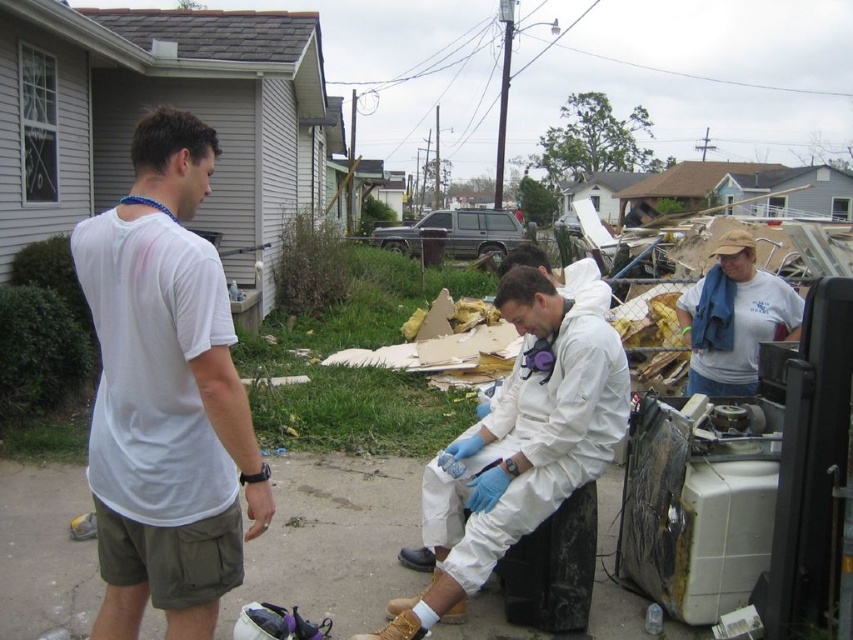
Between white cotton t-shirt at left and white matte hazmat suit at center, which one appears on the left side from the viewer's perspective?

white cotton t-shirt at left is more to the left.

Which is behind, point (219, 433) or point (425, 621)?

The point (425, 621) is behind.

The image size is (853, 640). Identify the location of white cotton t-shirt at left. (165, 394).

Which is below, white cotton t-shirt at left or white t-shirt at right?

white cotton t-shirt at left

Does white cotton t-shirt at left come behind white t-shirt at right?

No, white cotton t-shirt at left is closer to the viewer.

Between point (230, 502) and point (686, 298), which one is positioned behind?

The point (686, 298) is behind.

Where is `white cotton t-shirt at left`? white cotton t-shirt at left is located at coordinates (165, 394).

In the scene shown: Can you confirm if white matte hazmat suit at center is positioned to the right of white t-shirt at right?

In fact, white matte hazmat suit at center is to the left of white t-shirt at right.

Locate an element on the screen. white matte hazmat suit at center is located at coordinates tap(518, 448).